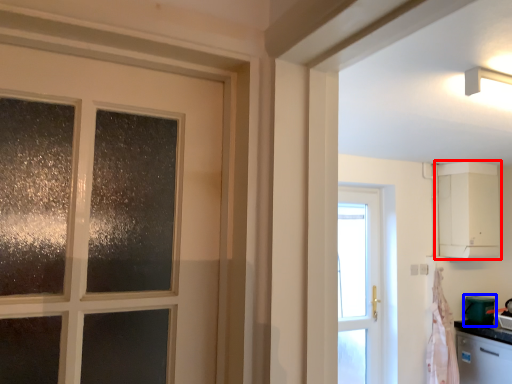
Question: Which of the following is the closest to the observer, cabinetry (highlighted by a red box) or appliance (highlighted by a blue box)?

Choices:
 (A) cabinetry
 (B) appliance

Answer: (A)